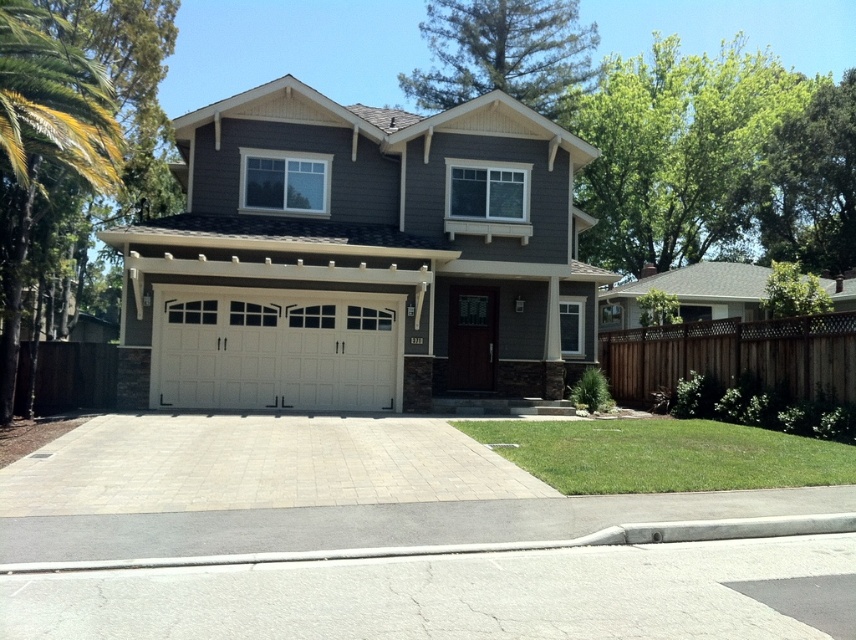
You are a delivery person approaching the house and need to park your vehicle. The driveway can accommodate vehicles, but you must ensure the garage door is accessible. Based on the scene, where should you park your vehicle to ensure the white wood garage door at center remains visible from the gray asphalt driveway at lower center?

The white wood garage door at center is positioned on the left side of the gray asphalt driveway at lower center. To keep the garage door visible, you should park on the right side of the driveway so the garage door remains in view.